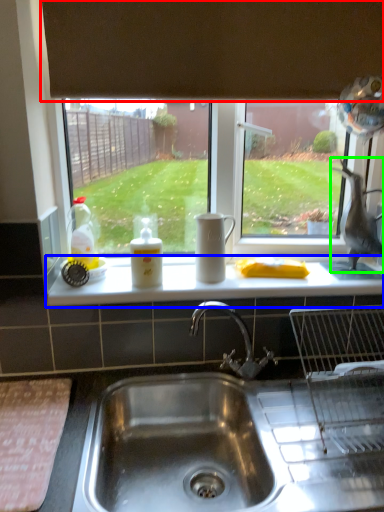
Question: Which object is the closest to the exhaust hood (highlighted by a red box)? Choose among these: counter top (highlighted by a blue box) or animal (highlighted by a green box).

Choices:
 (A) counter top
 (B) animal

Answer: (B)